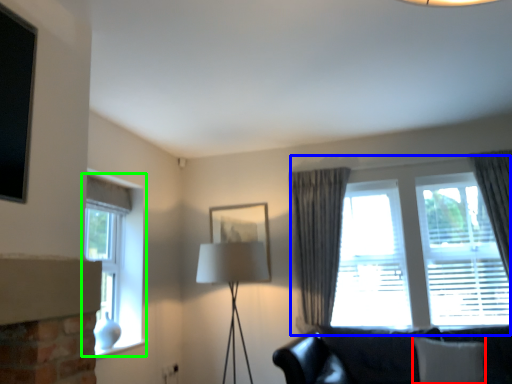
Question: Which object is the farthest from pillow (highlighted by a red box)? Choose among these: window (highlighted by a blue box) or window (highlighted by a green box).

Choices:
 (A) window
 (B) window

Answer: (B)